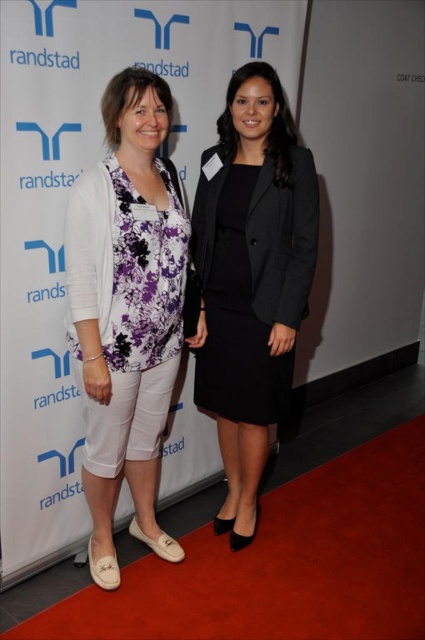
You are standing in front of the two women on the red carpet. You want to hand a gift to the woman wearing the black matte blazer at center without approaching closer than 5 feet. Is the current distance sufficient?

The distance between you and the black matte blazer at center is 6.33 feet, which is more than the 5 feet minimum requirement. Therefore, you can hand the gift without moving closer than 5 feet.

You are a photographer at the event and need to ensure both outfits are visible in the photo. Given the white floral blouse at center and the black matte dress at center, which one might require more space due to its size?

The white floral blouse at center is bigger than the black matte dress at center, so it would require more space in the photo.